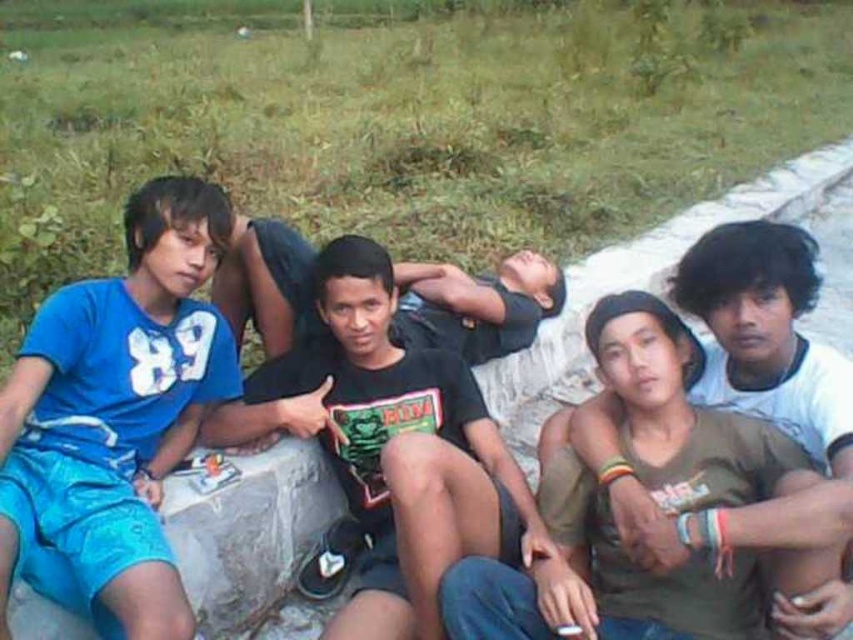
Who is taller, matte blue shorts at left or blue fabric shorts at lower left?

matte blue shorts at left

In the scene shown: Can you confirm if matte blue shorts at left is smaller than blue fabric shorts at lower left?

Incorrect, matte blue shorts at left is not smaller in size than blue fabric shorts at lower left.

Does point (152, 323) come farther from viewer compared to point (274, 472)?

No.

The height and width of the screenshot is (640, 853). In order to click on matte blue shorts at left in this screenshot , I will do `click(115, 417)`.

Can you confirm if green grass at upper center is positioned below black matte shirt at center?

Actually, green grass at upper center is above black matte shirt at center.

Who is shorter, green grass at upper center or black matte shirt at center?

With less height is black matte shirt at center.

Find the location of a particular element. Image resolution: width=853 pixels, height=640 pixels. green grass at upper center is located at coordinates (399, 120).

Does black matte t-shirt at center have a greater width compared to black matte shirt at center?

Yes.

Locate an element on the screen. black matte t-shirt at center is located at coordinates (403, 449).